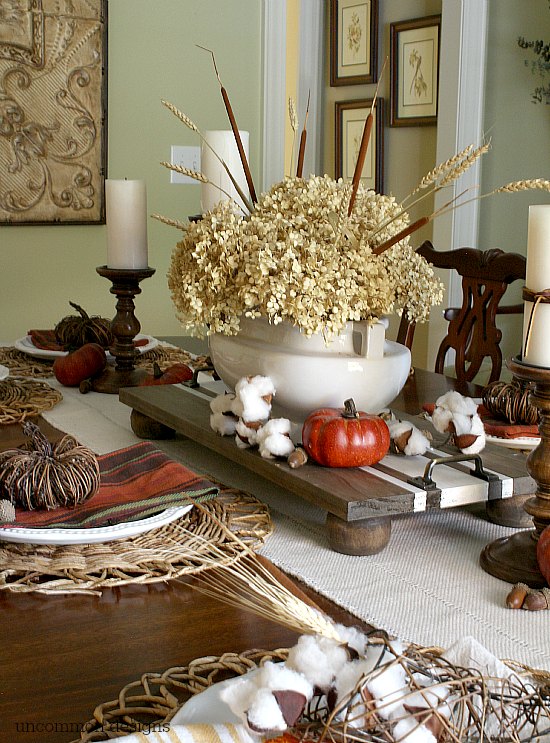
Find the location of a particular element. basket is located at coordinates click(x=163, y=678).